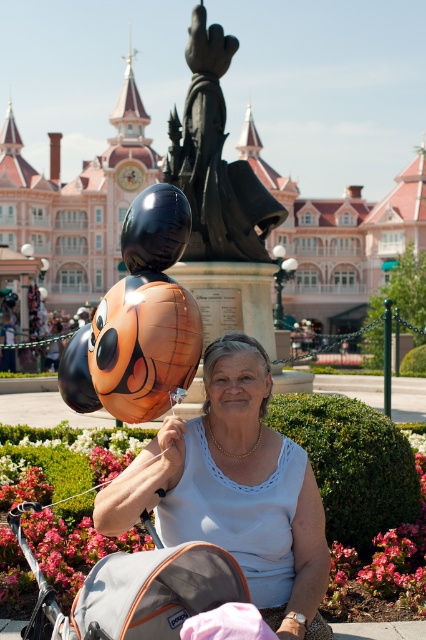
You are a photographer standing in the Disney theme park and want to take a picture of the white fabric shirt at center and the black polished statue at center. Which object is closer to the camera?

The white fabric shirt at center is positioned under the black polished statue at center, meaning it is closer to the camera.

You are a photographer trying to capture a photo of the black polished statue at center without the white fabric shirt at center blocking it. What should you do?

Move to a position where the black polished statue at center is no longer behind the white fabric shirt at center. Since the white fabric shirt at center is currently in front of the black polished statue at center, adjusting your angle or moving around the statue will allow you to take a clear photo of the statue without obstruction.

You are a parent pushing a stroller with your child in it. You see the gray fabric baby carriage at lower center and the black polished statue at center in front of you. Which object is closer to your right side?

The black polished statue at center is closer to your right side because the gray fabric baby carriage at lower center is to the left of it.